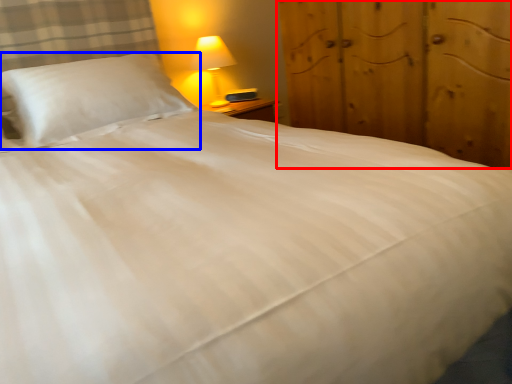
Question: Among these objects, which one is farthest to the camera, dresser (highlighted by a red box) or pillow (highlighted by a blue box)?

Choices:
 (A) dresser
 (B) pillow

Answer: (B)